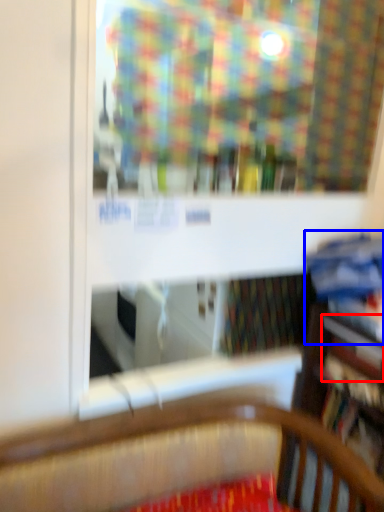
Question: Among these objects, which one is nearest to the camera, book (highlighted by a red box) or book (highlighted by a blue box)?

Choices:
 (A) book
 (B) book

Answer: (B)